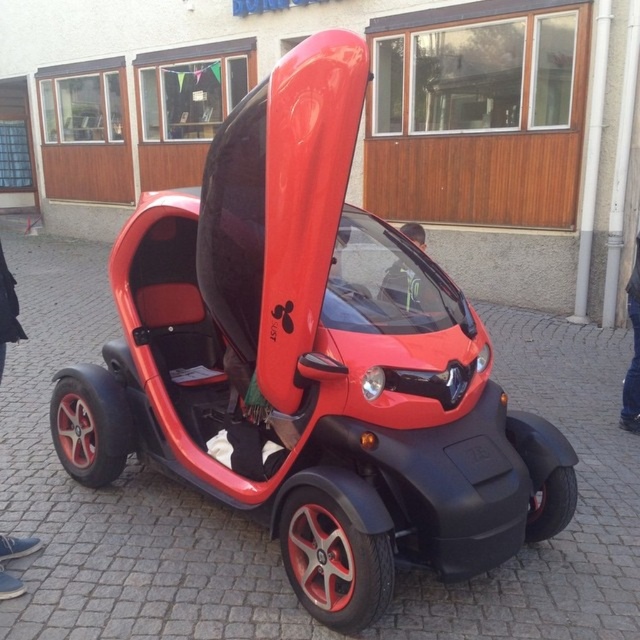
Question: Which is nearer to the black rubber wheel at lower right?

Choices:
 (A) red matte wheel at lower center
 (B) red matte wheel at lower left

Answer: (A)

Question: Is red matte wheel at lower center closer to the viewer compared to black rubber wheel at lower right?

Choices:
 (A) yes
 (B) no

Answer: (A)

Question: Considering the real-world distances, which object is closest to the red matte wheel at lower center?

Choices:
 (A) red matte wheel at lower left
 (B) black rubber wheel at lower right

Answer: (B)

Question: Is red matte wheel at lower center above black rubber wheel at lower right?

Choices:
 (A) yes
 (B) no

Answer: (B)

Question: In this image, where is red matte wheel at lower center located relative to black rubber wheel at lower right?

Choices:
 (A) left
 (B) right

Answer: (A)

Question: Which object appears closest to the camera in this image?

Choices:
 (A) red matte wheel at lower center
 (B) red matte wheel at lower left

Answer: (A)